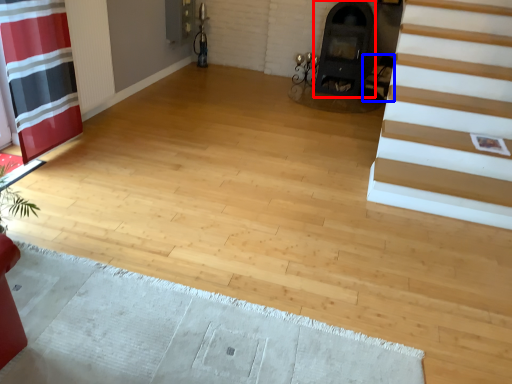
Question: Which of the following is the closest to the observer, fireplace (highlighted by a red box) or armchair (highlighted by a blue box)?

Choices:
 (A) fireplace
 (B) armchair

Answer: (A)